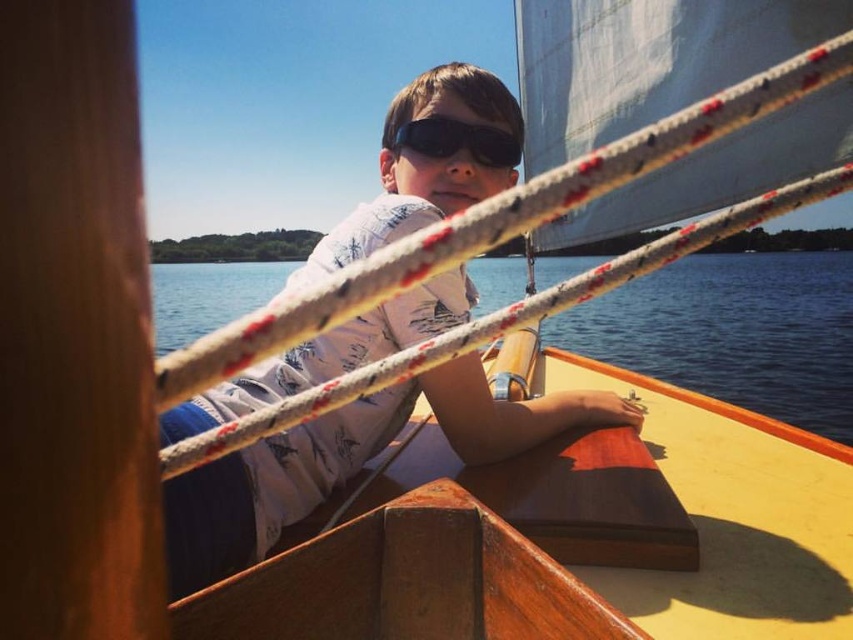
Who is taller, white cotton shirt at center or black matte goggles at center?

Standing taller between the two is white cotton shirt at center.

Who is more forward, (258, 456) or (422, 154)?

Point (258, 456)

Find the location of a particular element. This screenshot has height=640, width=853. white cotton shirt at center is located at coordinates (347, 461).

Is clear blue water at center positioned before black matte goggles at center?

Yes, it is.

Can you confirm if clear blue water at center is positioned to the left of black matte goggles at center?

Incorrect, clear blue water at center is not on the left side of black matte goggles at center.

I want to click on clear blue water at center, so click(x=733, y=332).

Identify the location of clear blue water at center. (733, 332).

Who is higher up, white cotton shirt at center or clear blue water at center?

Positioned higher is clear blue water at center.

Does white cotton shirt at center lie in front of clear blue water at center?

No, white cotton shirt at center is behind clear blue water at center.

Is point (271, 378) farther from viewer compared to point (711, 368)?

No, (271, 378) is closer to viewer.

Where is `white cotton shirt at center`? The image size is (853, 640). white cotton shirt at center is located at coordinates (347, 461).